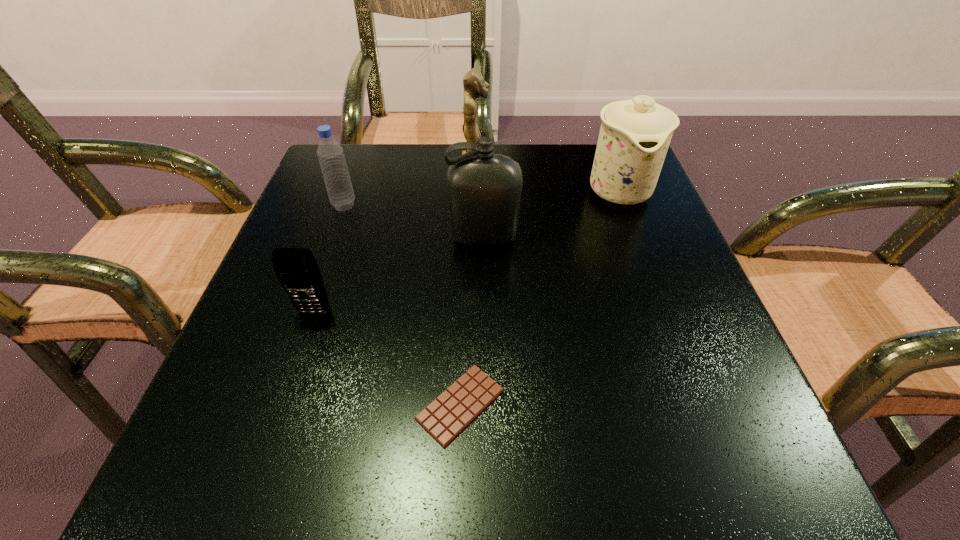
Where is `figurine`? Image resolution: width=960 pixels, height=540 pixels. figurine is located at coordinates (474, 85).

Locate an element on the screen. The height and width of the screenshot is (540, 960). chinaware is located at coordinates (635, 134).

At what (x,y) coordinates should I click in order to perform the action: click on the third nearest object. Please return your answer as a coordinate pair (x, y). The image size is (960, 540). Looking at the image, I should click on tap(484, 189).

At what (x,y) coordinates should I click in order to perform the action: click on the taller bottle. Please return your answer as a coordinate pair (x, y). Looking at the image, I should click on pos(484,189).

Identify the location of the farther bottle. This screenshot has width=960, height=540. (331, 157).

Locate an element on the screen. The width and height of the screenshot is (960, 540). the left bottle is located at coordinates (331, 157).

You are a GUI agent. You are given a task and a screenshot of the screen. Output one action in this format:
    pyautogui.click(x=<x>, y=<y>)
    Task: Click on the cellular telephone
    This screenshot has width=960, height=540.
    Given the screenshot: What is the action you would take?
    pyautogui.click(x=296, y=269)

Where is `the second nearest object`? the second nearest object is located at coordinates pos(296,269).

You are a GUI agent. You are given a task and a screenshot of the screen. Output one action in this format:
    pyautogui.click(x=<x>, y=<y>)
    Task: Click on the candy bar
    
    Given the screenshot: What is the action you would take?
    tap(450, 413)

At what (x,y) coordinates should I click in order to perform the action: click on the shortest object. Please return your answer as a coordinate pair (x, y). This screenshot has width=960, height=540. Looking at the image, I should click on (450, 413).